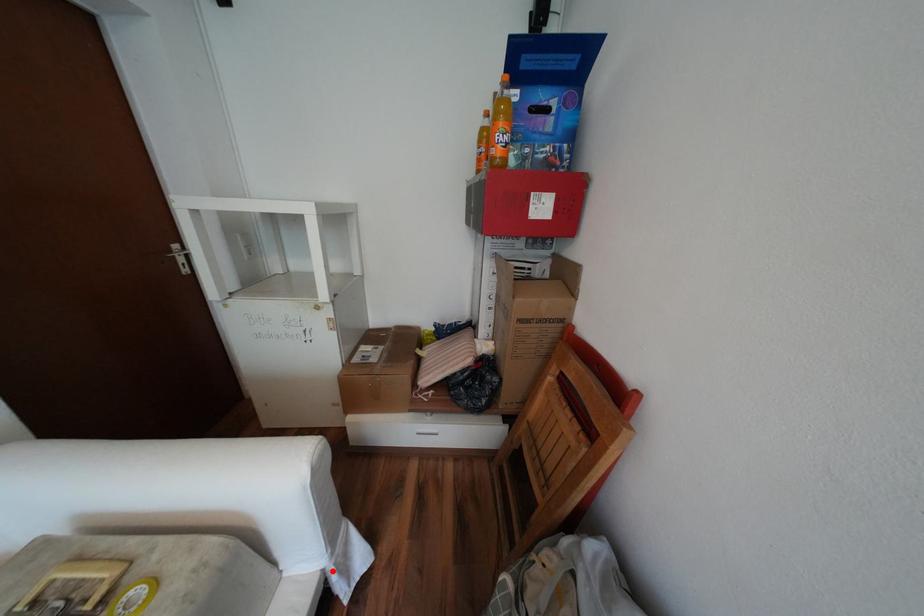
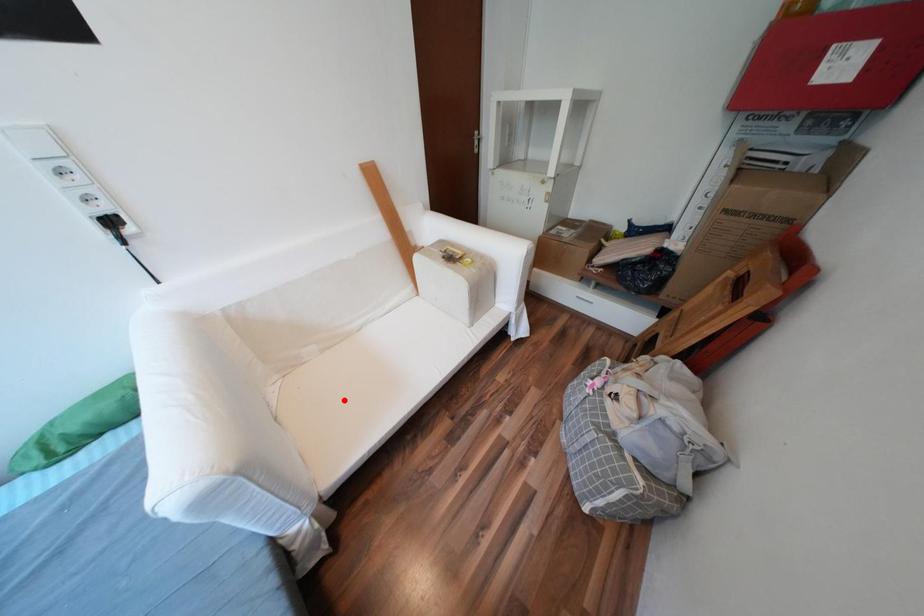
I am providing you with two images of the same scene from different viewpoints. A red point is marked on the first image and another point is marked on the second image. Is the marked point in image1 the same physical position as the marked point in image2?

No